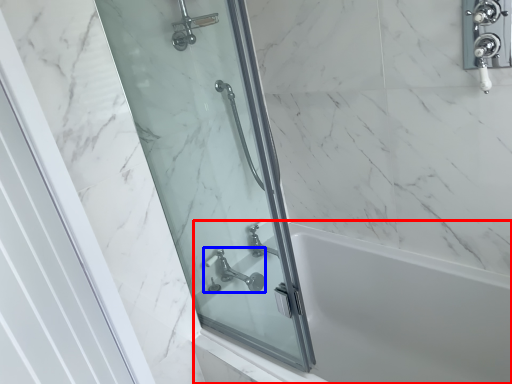
Question: Among these objects, which one is nearest to the camera, bath (highlighted by a red box) or tap (highlighted by a blue box)?

Choices:
 (A) bath
 (B) tap

Answer: (A)